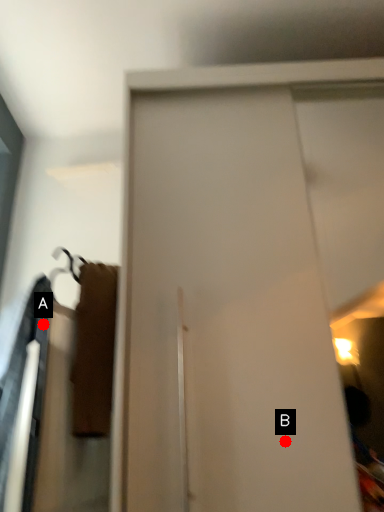
Question: Two points are circled on the image, labeled by A and B beside each circle. Which point is farther to the camera?

Choices:
 (A) A is further
 (B) B is further

Answer: (A)